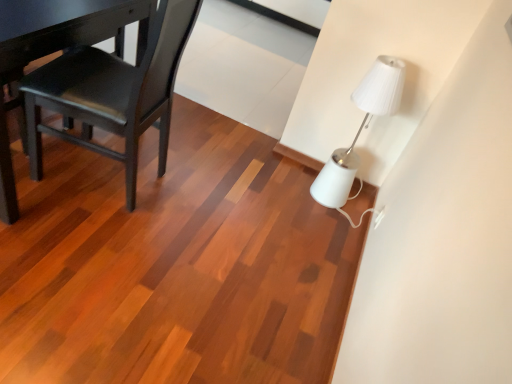
Question: Relative to white plastic electric outlet at lower right, is matte black chair at left in front or behind?

Choices:
 (A) behind
 (B) front

Answer: (B)

Question: Is matte black chair at left inside the boundaries of white plastic electric outlet at lower right, or outside?

Choices:
 (A) outside
 (B) inside

Answer: (A)

Question: Estimate the real-world distances between objects in this image. Which object is farther from the matte black chair at left?

Choices:
 (A) white glossy lamp at upper right
 (B) white plastic electric outlet at lower right

Answer: (B)

Question: Which is nearer to the matte black chair at left?

Choices:
 (A) white plastic electric outlet at lower right
 (B) white glossy lamp at upper right

Answer: (B)